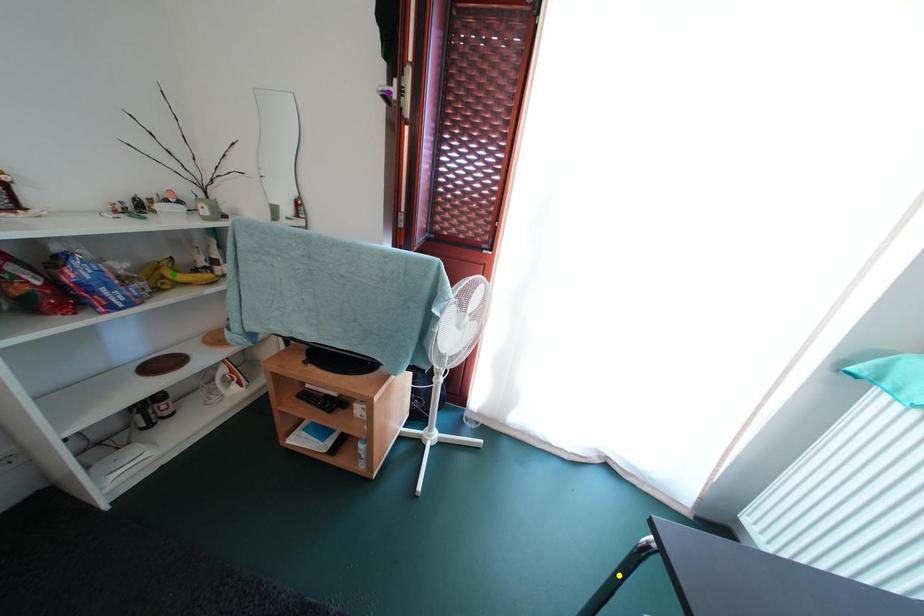
Order these from nearest to farthest:
purple point, green point, yellow point

yellow point → purple point → green point